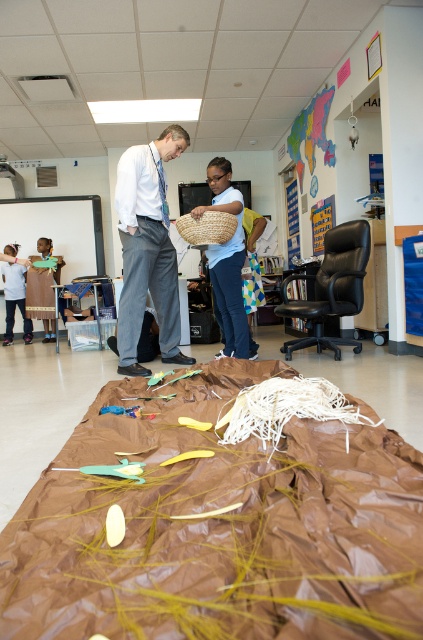
Is white cotton pants at center closer to the viewer compared to brown fabric dress at lower left?

That is True.

Who is higher up, white cotton pants at center or brown fabric dress at lower left?

white cotton pants at center is above.

Image resolution: width=423 pixels, height=640 pixels. I want to click on white cotton pants at center, so click(148, 250).

Based on the photo, is brown paper bag at center above brown fabric dress at lower left?

Actually, brown paper bag at center is below brown fabric dress at lower left.

Is brown paper bag at center further to camera compared to brown fabric dress at lower left?

No, brown paper bag at center is in front of brown fabric dress at lower left.

Who is more distant from viewer, (247, 497) or (43, 253)?

Positioned behind is point (43, 253).

Identify the location of brown paper bag at center. (217, 528).

Between point (10, 282) and point (208, 211), which one is positioned in front?

Point (208, 211) is in front.

Which is more to the left, matte blue shirt at left or woven straw basket at center?

Positioned to the left is matte blue shirt at left.

Locate an element on the screen. The height and width of the screenshot is (640, 423). matte blue shirt at left is located at coordinates (x=14, y=292).